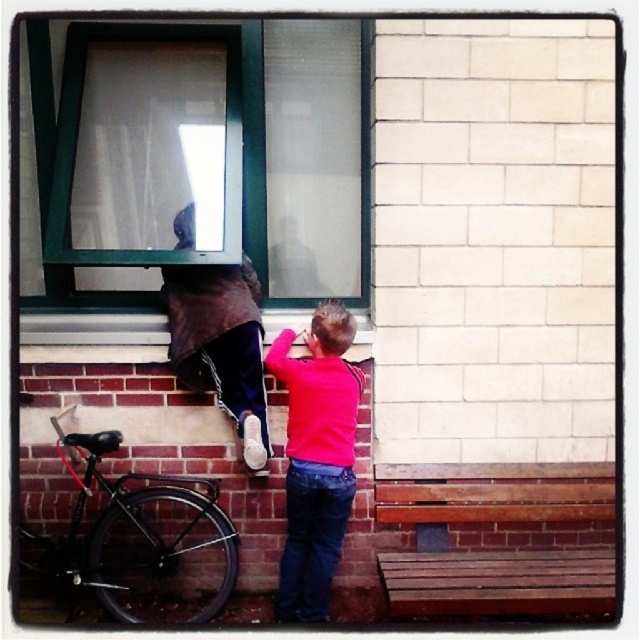
You are a painter who needs to place a ladder to reach the green frame glass window at upper center and the pink matte sweater at center. Which object requires a taller ladder based on their positions?

The green frame glass window at upper center is located at upper center, so it requires a taller ladder than the pink matte sweater at center.

You are a delivery person trying to reach the pink matte sweater at center through the window. There is a black matte bicycle at lower left blocking your path. Can you go around the bicycle to access the window?

The black matte bicycle at lower left is below the pink matte sweater at center, so you can go around the bicycle to access the window since it is positioned lower and not directly in front of the window.